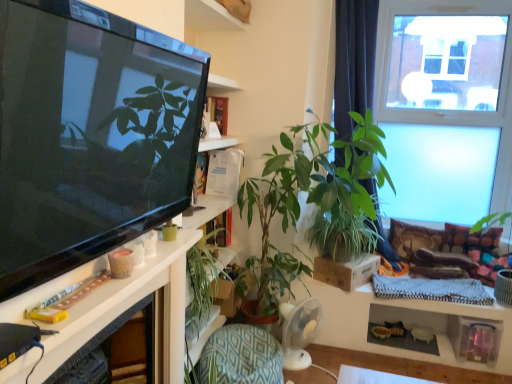
Where is `free space above white glossy shelf at left (from a real-world perspective)`? The width and height of the screenshot is (512, 384). free space above white glossy shelf at left (from a real-world perspective) is located at coordinates (91, 285).